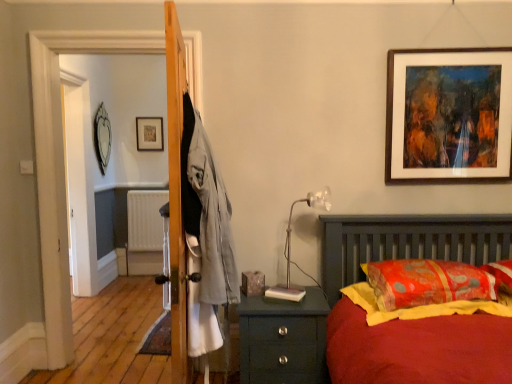
Question: Is translucent plastic table lamp at right taller or shorter than wooden screen door at left?

Choices:
 (A) short
 (B) tall

Answer: (A)

Question: Is translucent plastic table lamp at right inside the boundaries of wooden screen door at left, or outside?

Choices:
 (A) inside
 (B) outside

Answer: (B)

Question: Considering the real-world distances, which object is closest to the white plastic radiator at center?

Choices:
 (A) orange fabric pillow at right
 (B) brown wooden picture frame at upper right, the 3th picture frame when ordered from left to right
 (C) translucent plastic table lamp at right
 (D) wooden screen door at left
 (E) silver metallic mirror at upper left, arranged as the first picture frame when viewed from the left

Answer: (E)

Question: Based on their relative distances, which object is farther from the orange fabric pillow at right?

Choices:
 (A) brown wooden picture frame at upper right, arranged as the 1th picture frame when viewed from the front
 (B) white plastic radiator at center
 (C) teal wooden nightstand at lower right
 (D) silver metallic mirror at upper left, arranged as the first picture frame when viewed from the left
 (E) wooden screen door at left

Answer: (D)